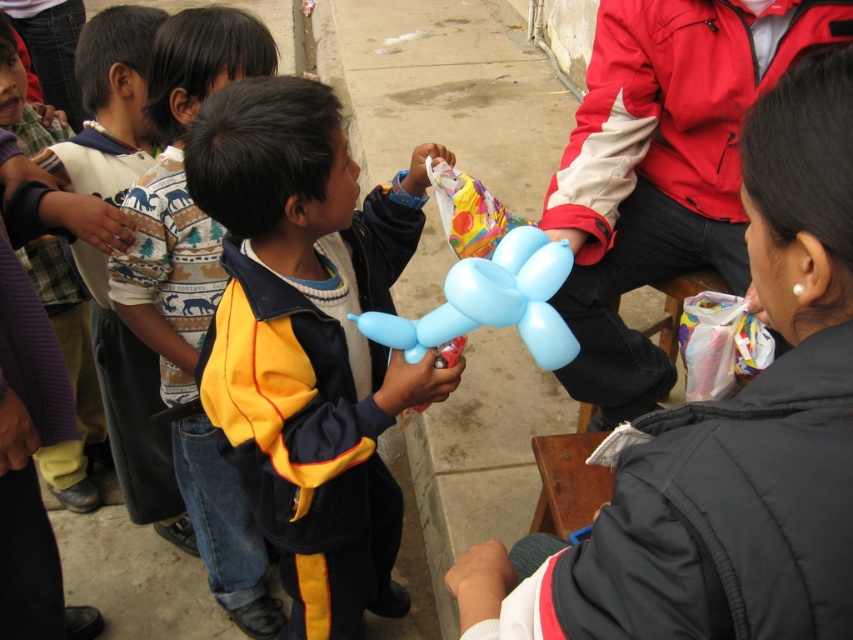
Does yellow fabric jacket at left appear on the left side of matte blue balloon at center?

Yes, yellow fabric jacket at left is to the left of matte blue balloon at center.

Does yellow fabric jacket at left have a lesser width compared to matte blue balloon at center?

Incorrect, yellow fabric jacket at left's width is not less than matte blue balloon at center's.

Where is `yellow fabric jacket at left`? Image resolution: width=853 pixels, height=640 pixels. yellow fabric jacket at left is located at coordinates (194, 296).

Can you confirm if yellow matte jacket at center is smaller than matte blue balloon at center?

Actually, yellow matte jacket at center might be larger than matte blue balloon at center.

Image resolution: width=853 pixels, height=640 pixels. I want to click on yellow matte jacket at center, so click(306, 342).

Is yellow matte jacket at center to the right of yellow fabric jacket at left from the viewer's perspective?

Indeed, yellow matte jacket at center is positioned on the right side of yellow fabric jacket at left.

Is yellow matte jacket at center bigger than yellow fabric jacket at left?

Indeed, yellow matte jacket at center has a larger size compared to yellow fabric jacket at left.

You are a GUI agent. You are given a task and a screenshot of the screen. Output one action in this format:
    pyautogui.click(x=<x>, y=<y>)
    Task: Click on the yellow matte jacket at center
    This screenshot has width=853, height=640.
    Given the screenshot: What is the action you would take?
    pyautogui.click(x=306, y=342)